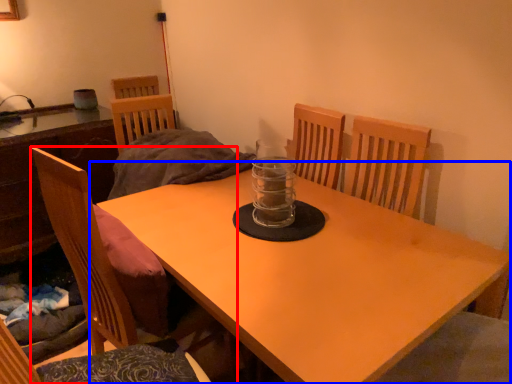
Question: Which object is closer to the camera taking this photo, chair (highlighted by a red box) or table (highlighted by a blue box)?

Choices:
 (A) chair
 (B) table

Answer: (A)